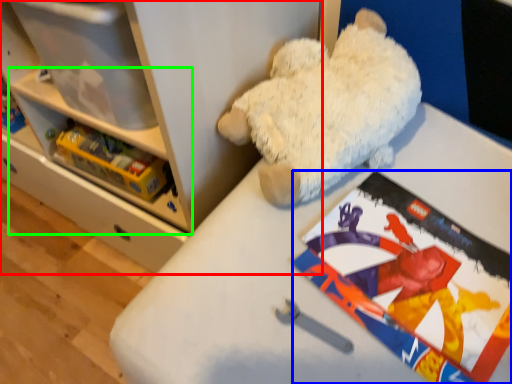
Question: Based on their relative distances, which object is farther from shelf (highlighted by a red box)? Choose from comic book (highlighted by a blue box) and shelf (highlighted by a green box).

Choices:
 (A) comic book
 (B) shelf

Answer: (A)